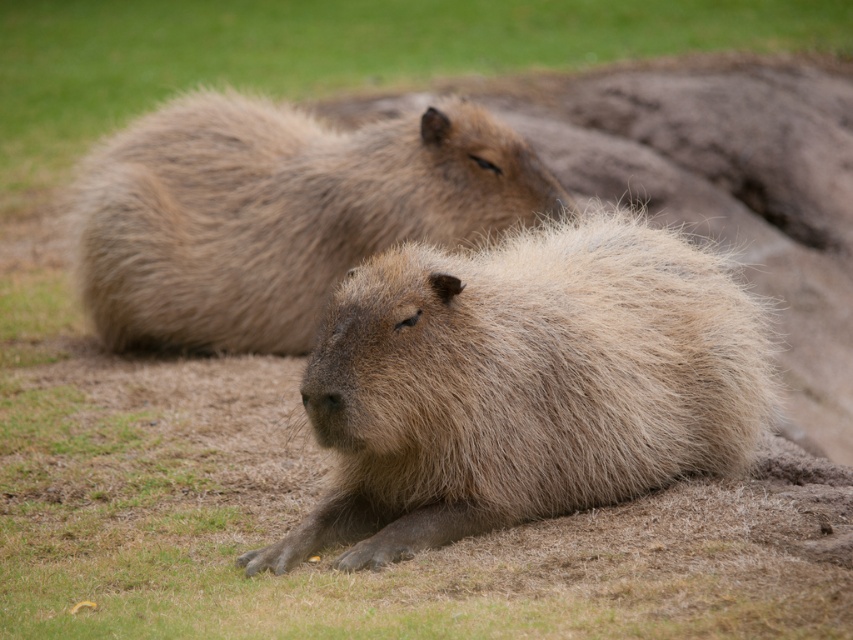
Consider the image. Can you confirm if brown fuzzy capybara at center is positioned to the left of brown fuzzy capybara at upper center?

No, brown fuzzy capybara at center is not to the left of brown fuzzy capybara at upper center.

I want to click on brown fuzzy capybara at center, so click(523, 385).